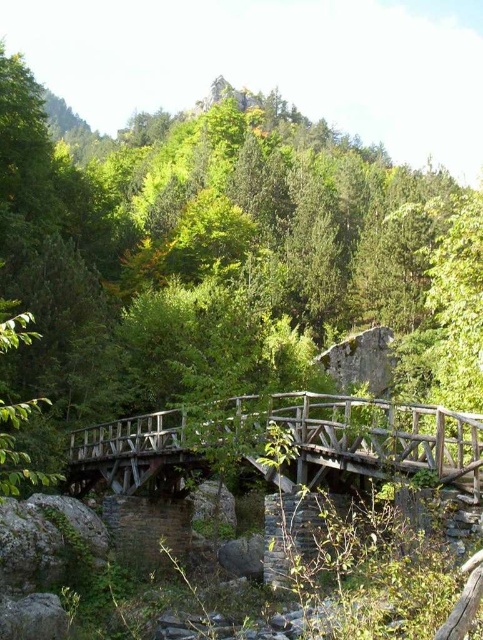
From the picture: You are a hiker standing on the wooden bridge at center. Looking towards the green matte tree at center, which direction should you face to see it?

The green matte tree at center is to the left of the wooden bridge at center, so you should face left to see it.

You are a hiker standing on the wooden bridge at center and looking towards the green matte tree at center. Which object is higher from the ground?

The green matte tree at center is taller than the wooden bridge at center, so the green matte tree at center is higher from the ground.

You are a hiker who wants to cross the wooden bridge at center to reach the other side of the stream. However, you notice the green matte tree at center is in the way. Can you walk under the tree to cross the bridge?

The green matte tree at center is positioned over the wooden bridge at center, so yes, you can walk under the tree to cross the bridge.